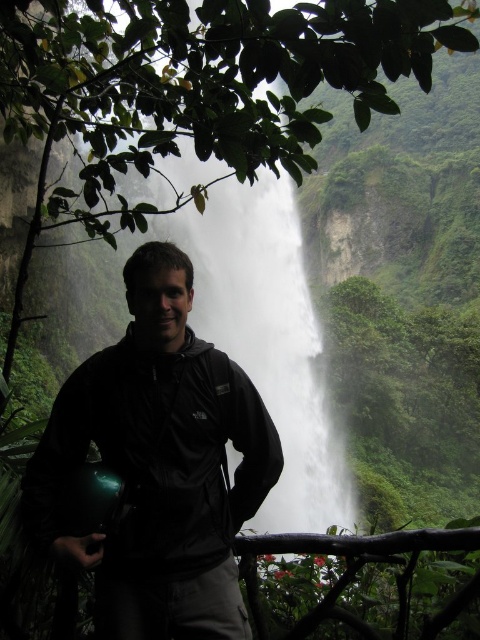
Does black matte jacket at center have a larger size compared to brown wooden rail at lower center?

Actually, black matte jacket at center might be smaller than brown wooden rail at lower center.

Can you confirm if black matte jacket at center is wider than brown wooden rail at lower center?

Incorrect, black matte jacket at center's width does not surpass brown wooden rail at lower center's.

Between point (176, 445) and point (328, 611), which one is positioned in front?

Point (328, 611) is in front.

At what (x,y) coordinates should I click in order to perform the action: click on black matte jacket at center. Please return your answer as a coordinate pair (x, y). Looking at the image, I should click on (158, 465).

Is black matte jacket at center positioned before white misty waterfall at center?

Yes, black matte jacket at center is in front of white misty waterfall at center.

Is black matte jacket at center behind white misty waterfall at center?

No, it is in front of white misty waterfall at center.

What are the coordinates of `black matte jacket at center` in the screenshot? It's located at (158, 465).

Can you confirm if white misty waterfall at center is positioned to the right of brown wooden rail at lower center?

Incorrect, white misty waterfall at center is not on the right side of brown wooden rail at lower center.

Between point (327, 460) and point (369, 600), which one is positioned behind?

The point (327, 460) is behind.

At what (x,y) coordinates should I click in order to perform the action: click on white misty waterfall at center. Please return your answer as a coordinate pair (x, y). Looking at the image, I should click on (268, 339).

Identify the location of white misty waterfall at center. (268, 339).